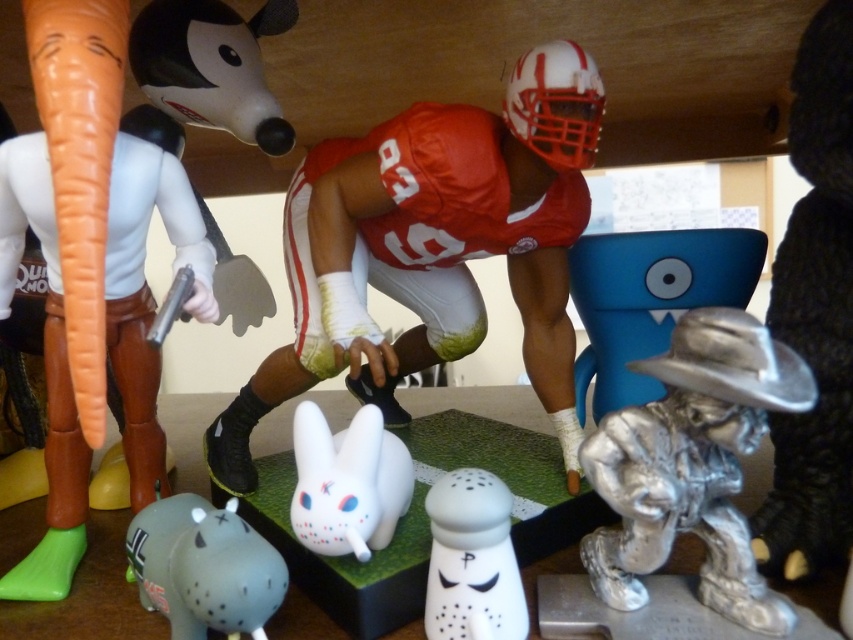
Question: Which of the following is the farthest from the observer?

Choices:
 (A) silver metallic cowboy at lower right
 (B) white matte jersey at center
 (C) white matte rabbit at center

Answer: (B)

Question: Can you confirm if gray matte hippo at lower left is wider than white matte jersey at center?

Choices:
 (A) yes
 (B) no

Answer: (A)

Question: Which point is farther to the camera?

Choices:
 (A) (212, 573)
 (B) (358, 506)
 (C) (384, 172)
 (D) (457, 508)

Answer: (C)

Question: Does smooth white rabbit at lower left appear under red matte number at center?

Choices:
 (A) no
 (B) yes

Answer: (B)

Question: Which of the following is the closest to the observer?

Choices:
 (A) red matte number at center
 (B) smooth white rabbit at lower left
 (C) gray matte hippo at lower left
 (D) silver metallic cowboy at lower right

Answer: (B)

Question: Does shiny plastic football player at center have a greater width compared to red matte number at center?

Choices:
 (A) yes
 (B) no

Answer: (A)